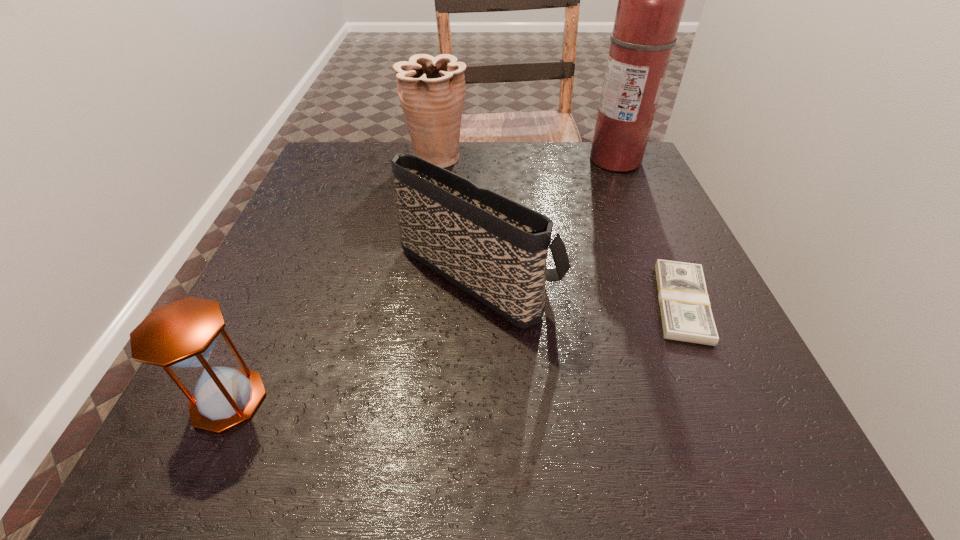
Locate an element on the screen. This screenshot has width=960, height=540. free location that satisfies the following two spatial constraints: 1. on the front-facing side of the dollar; 2. on the right side of the tallest object is located at coordinates (678, 303).

Where is `free space that satisfies the following two spatial constraints: 1. on the back side of the dollar; 2. on the front-facing side of the fire extinguisher`? free space that satisfies the following two spatial constraints: 1. on the back side of the dollar; 2. on the front-facing side of the fire extinguisher is located at coordinates (618, 161).

At what (x,y) coordinates should I click in order to perform the action: click on blank area in the image that satisfies the following two spatial constraints: 1. on the front-facing side of the fire extinguisher; 2. on the front side of the handbag. Please return your answer as a coordinate pair (x, y). The width and height of the screenshot is (960, 540). Looking at the image, I should click on (663, 269).

In order to click on vacant area in the image that satisfies the following two spatial constraints: 1. on the front side of the shortest object; 2. on the right side of the urn in this screenshot , I will do point(416,303).

Find the location of a particular element. This screenshot has height=540, width=960. free space that satisfies the following two spatial constraints: 1. on the front-facing side of the tallest object; 2. on the left side of the dollar is located at coordinates (678, 303).